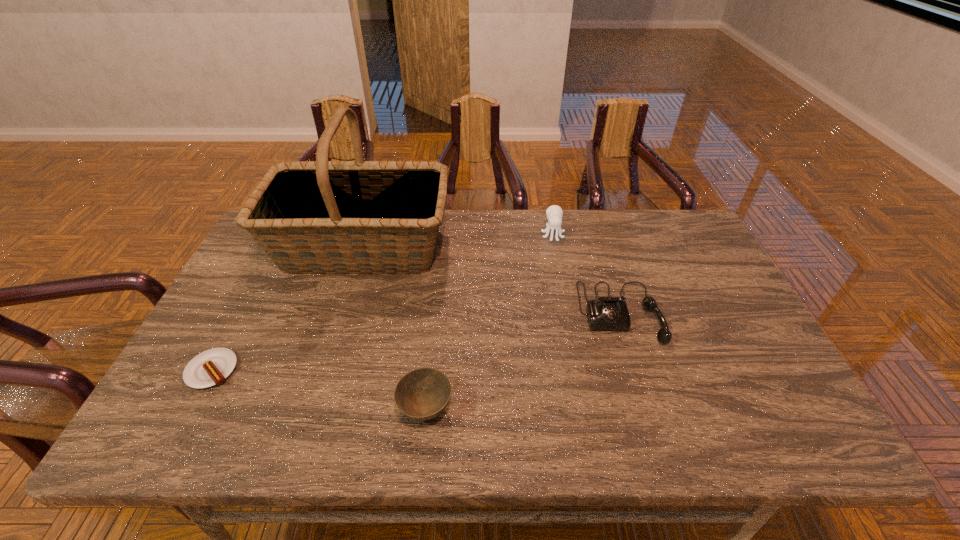
At what (x,y) coordinates should I click in order to perform the action: click on empty location between the telephone and the octopus. Please return your answer as a coordinate pair (x, y). This screenshot has height=540, width=960. Looking at the image, I should click on (587, 274).

Identify the location of free space that is in between the fourth tallest object and the octopus. (490, 322).

Locate which object is the fourth closest to the sausage. Please provide its 2D coordinates. Your answer should be formatted as a tuple, i.e. [(x, y)], where the tuple contains the x and y coordinates of a point satisfying the conditions above.

[(554, 213)]

Identify which object is located as the nearest to the tallest object. Please provide its 2D coordinates. Your answer should be formatted as a tuple, i.e. [(x, y)], where the tuple contains the x and y coordinates of a point satisfying the conditions above.

[(211, 367)]

Identify the location of free spot that satisfies the following two spatial constraints: 1. on the front side of the sausage; 2. on the right side of the fourth tallest object. The width and height of the screenshot is (960, 540). (191, 410).

In order to click on vacant space that satisfies the following two spatial constraints: 1. on the front side of the bowl; 2. on the left side of the sausage in this screenshot , I will do `click(191, 410)`.